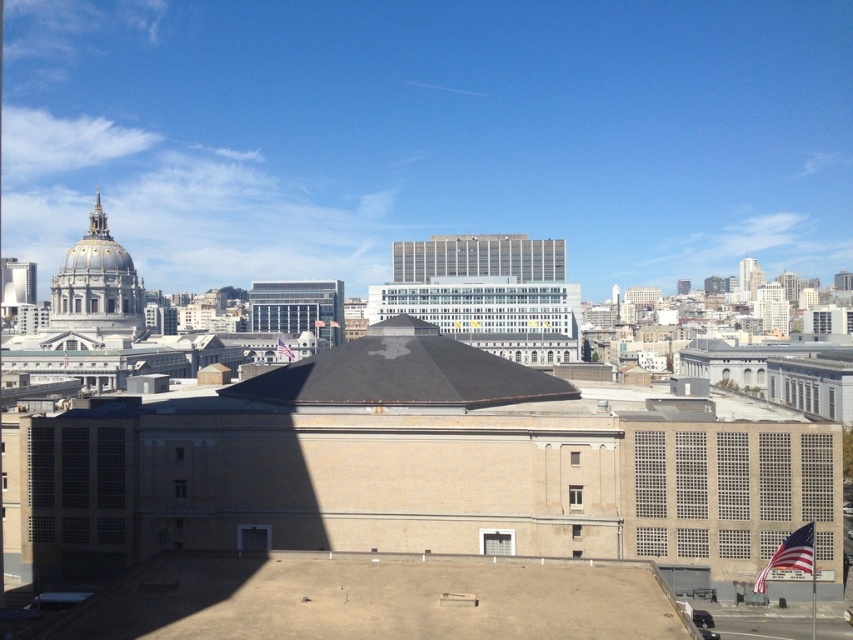
You are standing at the point marked by the coordinates point [402,372] in the cityscape. What is the color of the roof you are standing on?

The point [402,372] marks the black matte roof at center, so the roof you are standing on is black.